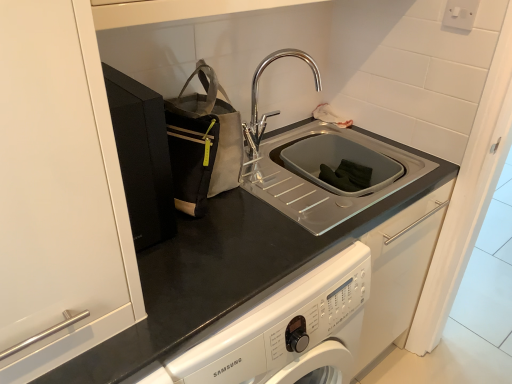
Describe the element at coordinates (203, 143) in the screenshot. Image resolution: width=512 pixels, height=384 pixels. I see `gray fabric tote at upper left` at that location.

The width and height of the screenshot is (512, 384). What are the coordinates of `chrome metallic faucet at upper center` in the screenshot? It's located at (257, 95).

What are the coordinates of `gray fabric tote at upper left` in the screenshot? It's located at (203, 143).

From the image's perspective, which object appears higher, chrome metallic faucet at upper center or white plastic electric outlet at upper right?

From the image's view, white plastic electric outlet at upper right is above.

Is the surface of chrome metallic faucet at upper center in direct contact with white plastic electric outlet at upper right?

They are not placed beside each other.

From a real-world perspective, is chrome metallic faucet at upper center located beneath white plastic electric outlet at upper right?

Indeed, from a real-world perspective, chrome metallic faucet at upper center is positioned beneath white plastic electric outlet at upper right.

In the scene shown: Which object is further away from the camera taking this photo, chrome metallic faucet at upper center or white plastic electric outlet at upper right?

Positioned behind is white plastic electric outlet at upper right.

Consider the image. From a real-world perspective, which object rests below the other?

chrome metallic faucet at upper center.

From the image's perspective, would you say white plastic electric outlet at upper right is shown under chrome metallic faucet at upper center?

Incorrect, from the image's perspective, white plastic electric outlet at upper right is higher than chrome metallic faucet at upper center.

From the picture: Can you confirm if white plastic electric outlet at upper right is wider than chrome metallic faucet at upper center?

No, white plastic electric outlet at upper right is not wider than chrome metallic faucet at upper center.

Considering the sizes of chrome metallic faucet at upper center and gray fabric tote at upper left in the image, is chrome metallic faucet at upper center taller or shorter than gray fabric tote at upper left?

Considering their sizes, chrome metallic faucet at upper center has less height than gray fabric tote at upper left.

From the image's perspective, is chrome metallic faucet at upper center located above or below gray fabric tote at upper left?

Based on their image positions, chrome metallic faucet at upper center is located above gray fabric tote at upper left.

Is chrome metallic faucet at upper center wider or thinner than gray fabric tote at upper left?

Clearly, chrome metallic faucet at upper center has less width compared to gray fabric tote at upper left.

Is chrome metallic faucet at upper center aimed at gray fabric tote at upper left?

No, chrome metallic faucet at upper center is not turned towards gray fabric tote at upper left.

In terms of size, does white plastic electric outlet at upper right appear bigger or smaller than gray fabric tote at upper left?

In the image, white plastic electric outlet at upper right appears to be smaller than gray fabric tote at upper left.

Which is closer, (x=453, y=19) or (x=185, y=164)?

Point (x=453, y=19) is farther from the camera than point (x=185, y=164).

Does white plastic electric outlet at upper right turn towards gray fabric tote at upper left?

No, white plastic electric outlet at upper right is not aimed at gray fabric tote at upper left.

From the picture: In the image, is white plastic electric outlet at upper right positioned in front of or behind gray fabric tote at upper left?

Clearly, white plastic electric outlet at upper right is behind gray fabric tote at upper left.

Is gray fabric tote at upper left bigger or smaller than white plastic electric outlet at upper right?

Considering their sizes, gray fabric tote at upper left takes up more space than white plastic electric outlet at upper right.

Can you tell me how much gray fabric tote at upper left and white plastic electric outlet at upper right differ in facing direction?

They differ by 87.8 degrees in their facing directions.

Is gray fabric tote at upper left far away from white plastic electric outlet at upper right?

gray fabric tote at upper left is actually quite close to white plastic electric outlet at upper right.

From a real-world perspective, which is physically below, gray fabric tote at upper left or white plastic electric outlet at upper right?

In real-world perspective, gray fabric tote at upper left is lower.

Looking at this image, is gray fabric tote at upper left positioned with its back to chrome metallic faucet at upper center?

No, gray fabric tote at upper left's orientation is not away from chrome metallic faucet at upper center.

Which object is positioned more to the right, gray fabric tote at upper left or chrome metallic faucet at upper center?

Positioned to the right is chrome metallic faucet at upper center.

Between gray fabric tote at upper left and chrome metallic faucet at upper center, which one is positioned behind?

chrome metallic faucet at upper center is behind.

Can you tell me how much gray fabric tote at upper left and chrome metallic faucet at upper center differ in facing direction?

1.85 degrees.

Find the location of `electric outlet above the chrome metallic faucet at upper center (from the image's perspective)`. electric outlet above the chrome metallic faucet at upper center (from the image's perspective) is located at coordinates (460, 14).

Where is `electric outlet positioned vertically above the chrome metallic faucet at upper center (from a real-world perspective)`? The image size is (512, 384). electric outlet positioned vertically above the chrome metallic faucet at upper center (from a real-world perspective) is located at coordinates (460, 14).

Which object lies further to the anchor point chrome metallic faucet at upper center, white plastic electric outlet at upper right or gray fabric tote at upper left?

white plastic electric outlet at upper right.

From the image, which object appears to be farther from white plastic electric outlet at upper right, gray fabric tote at upper left or chrome metallic faucet at upper center?

gray fabric tote at upper left.

Considering their positions, is chrome metallic faucet at upper center positioned closer to white plastic electric outlet at upper right than gray fabric tote at upper left?

Based on the image, chrome metallic faucet at upper center appears to be nearer to white plastic electric outlet at upper right.

In the scene shown: Looking at the image, which one is located closer to gray fabric tote at upper left, white plastic electric outlet at upper right or chrome metallic faucet at upper center?

The object closer to gray fabric tote at upper left is chrome metallic faucet at upper center.

From the image, which object appears to be nearer to gray fabric tote at upper left, chrome metallic faucet at upper center or white plastic electric outlet at upper right?

chrome metallic faucet at upper center is closer to gray fabric tote at upper left.

Looking at the image, which one is located closer to chrome metallic faucet at upper center, gray fabric tote at upper left or white plastic electric outlet at upper right?

gray fabric tote at upper left is closer to chrome metallic faucet at upper center.

Locate an element on the screen. tap located between gray fabric tote at upper left and white plastic electric outlet at upper right in the left-right direction is located at coordinates (257, 95).